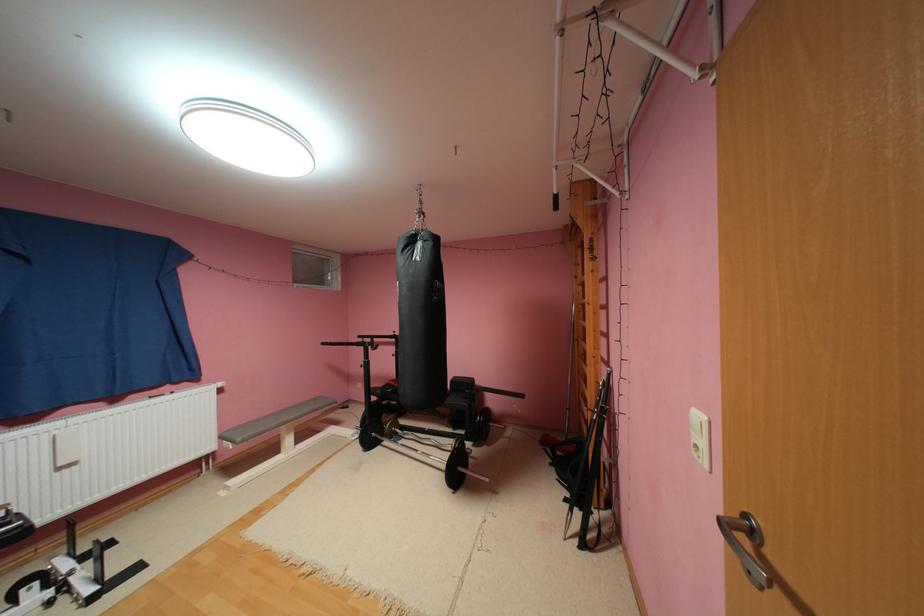
The location [420,322] corresponds to which object?

This point indicates the black punching bag.